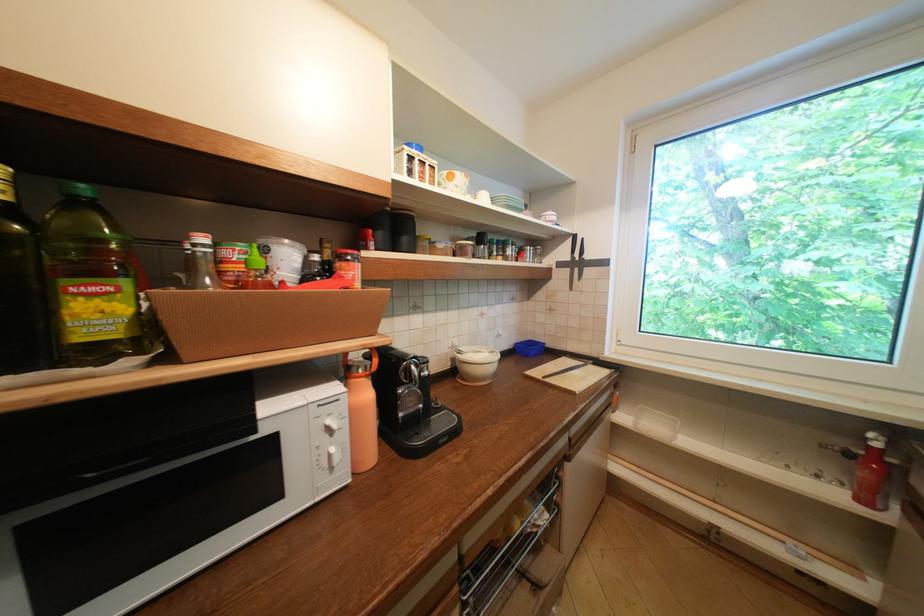
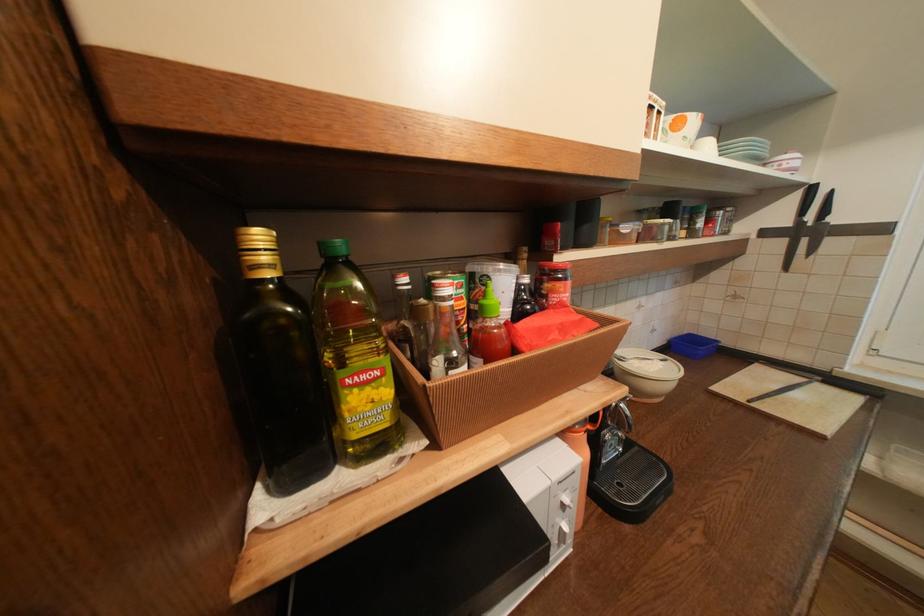
Locate, in the second image, the point that corresponds to point (337, 431) in the first image.

(573, 507)